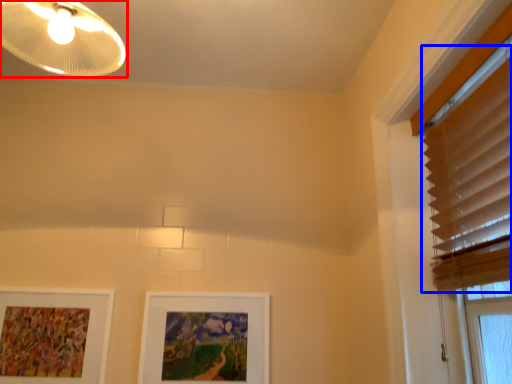
Question: Which object appears farthest to the camera in this image, lamp (highlighted by a red box) or blind (highlighted by a blue box)?

Choices:
 (A) lamp
 (B) blind

Answer: (A)